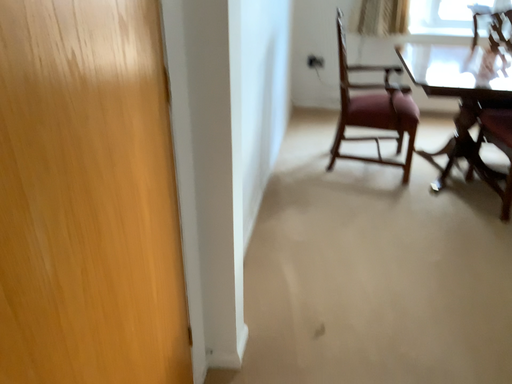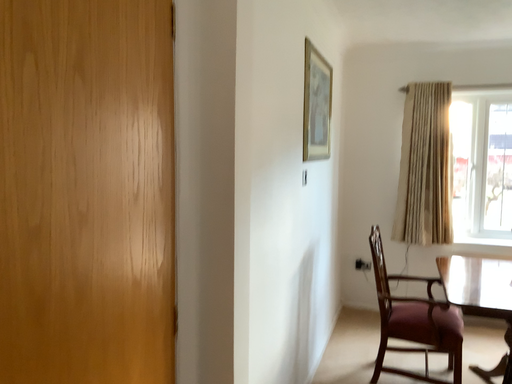
Question: Which way did the camera rotate in the video?

Choices:
 (A) rotated right
 (B) rotated left

Answer: (B)